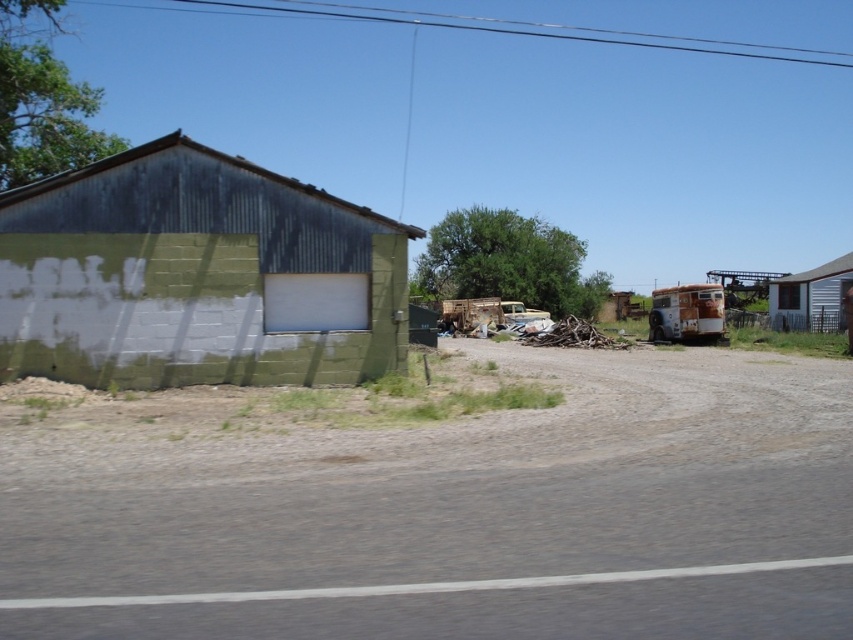
You are standing in the rural scene and want to take a photo of both point (47, 211) and point (844, 275). Which point should you focus on first to ensure both are in clear view?

Point (47, 211) is closer to the camera than point (844, 275), so you should focus on point (47, 211) first to ensure both are in clear view.